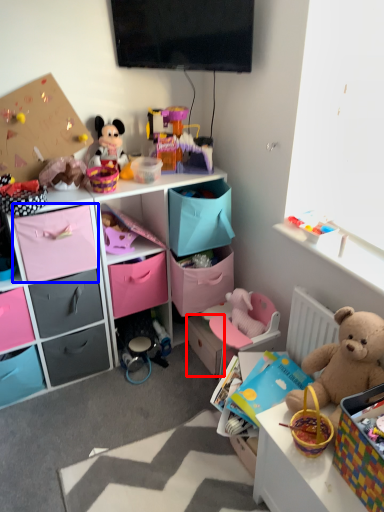
Question: Among these objects, which one is farthest to the camera, drawer (highlighted by a red box) or drawer (highlighted by a blue box)?

Choices:
 (A) drawer
 (B) drawer

Answer: (A)